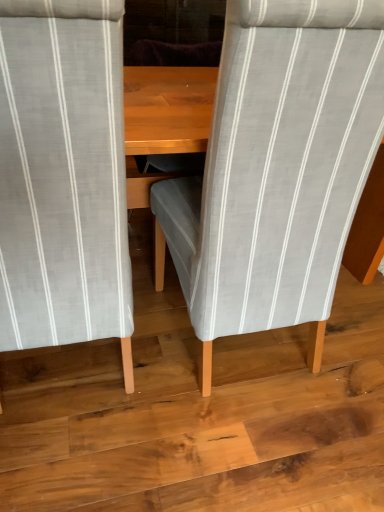
Locate an element on the screen. unoccupied area in front of light gray striped fabric chair at center, the first chair positioned from the right is located at coordinates (219, 449).